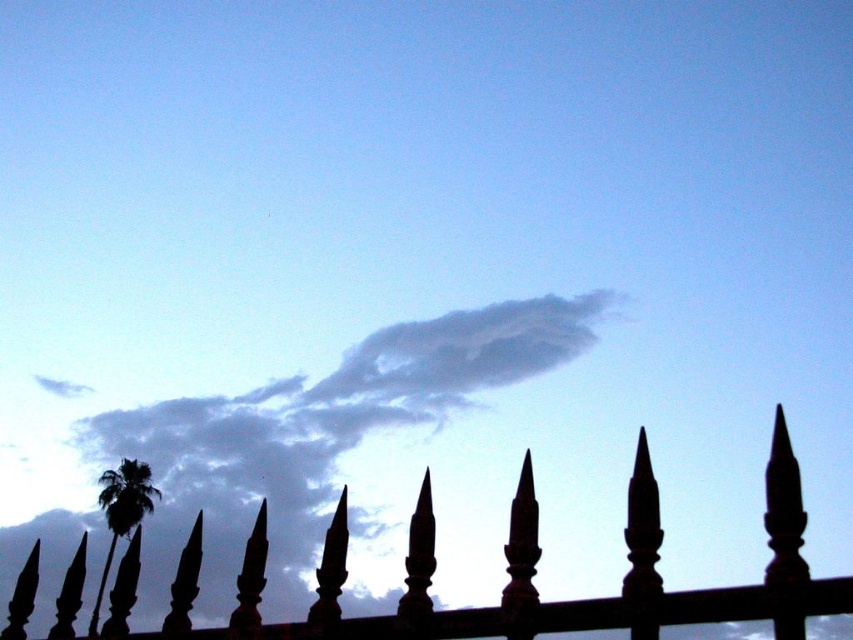
Does white fluffy cloud at upper center have a lesser height compared to green leafy palm at lower left?

Indeed, white fluffy cloud at upper center has a lesser height compared to green leafy palm at lower left.

Is white fluffy cloud at upper center wider than green leafy palm at lower left?

Correct, the width of white fluffy cloud at upper center exceeds that of green leafy palm at lower left.

Is point (335, 449) positioned after point (86, 628)?

Yes.

At what (x,y) coordinates should I click in order to perform the action: click on white fluffy cloud at upper center. Please return your answer as a coordinate pair (x, y). This screenshot has height=640, width=853. Looking at the image, I should click on (323, 429).

Between white fluffy cloud at upper center and black wrought iron fence at center, which one has less height?

black wrought iron fence at center is shorter.

Does white fluffy cloud at upper center have a greater width compared to black wrought iron fence at center?

Indeed, white fluffy cloud at upper center has a greater width compared to black wrought iron fence at center.

In order to click on white fluffy cloud at upper center in this screenshot , I will do `click(323, 429)`.

Who is more forward, (625, 616) or (112, 538)?

Point (625, 616)

Between point (32, 577) and point (100, 476), which one is positioned behind?

Positioned behind is point (100, 476).

Locate an element on the screen. The height and width of the screenshot is (640, 853). black wrought iron fence at center is located at coordinates (515, 577).

This screenshot has width=853, height=640. What are the coordinates of `black wrought iron fence at center` in the screenshot? It's located at (515, 577).